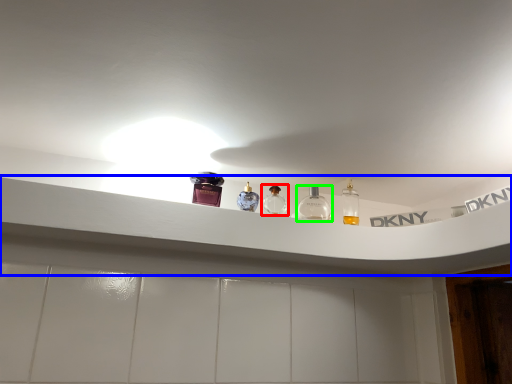
Question: Which object is the farthest from bottle (highlighted by a red box)? Choose among these: window sill (highlighted by a blue box) or bottle (highlighted by a green box).

Choices:
 (A) window sill
 (B) bottle

Answer: (A)